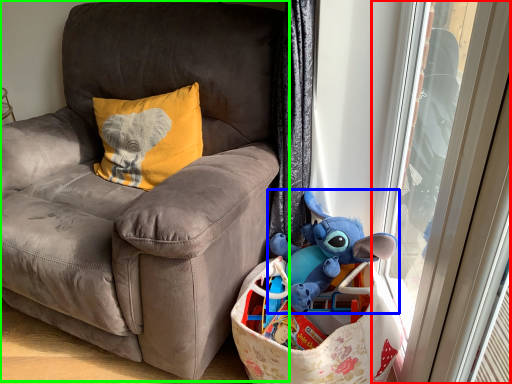
Question: Estimate the real-world distances between objects in this image. Which object is closer to screen door (highlighted by a red box), toy (highlighted by a blue box) or chair (highlighted by a green box)?

Choices:
 (A) toy
 (B) chair

Answer: (A)